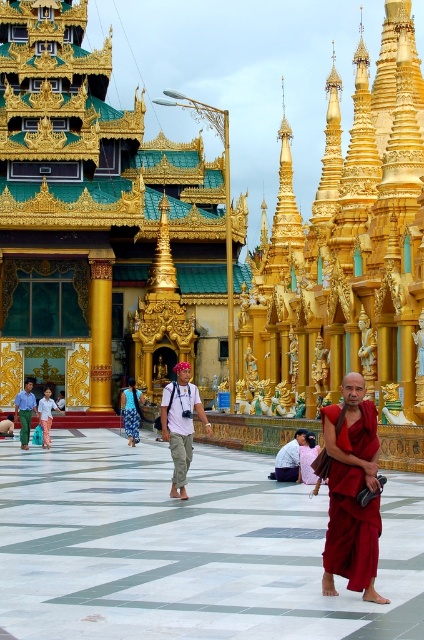
Can you confirm if blue printed fabric robe at center is positioned to the left of light pink cotton pants at center?

Incorrect, blue printed fabric robe at center is not on the left side of light pink cotton pants at center.

In the scene shown: Measure the distance between point (x=133, y=396) and camera.

The distance of point (x=133, y=396) from camera is 99.48 meters.

Who is more forward, (131, 417) or (39, 419)?

Point (39, 419)

The width and height of the screenshot is (424, 640). Identify the location of blue printed fabric robe at center. (131, 412).

Does light brown leather jacket at center have a greater width compared to light pink cotton pants at center?

In fact, light brown leather jacket at center might be narrower than light pink cotton pants at center.

Between light brown leather jacket at center and light pink cotton pants at center, which one has less height?

light brown leather jacket at center

Does point (282, 465) come closer to viewer compared to point (52, 404)?

Yes, point (282, 465) is in front of point (52, 404).

At what (x,y) coordinates should I click in order to perform the action: click on light brown leather jacket at center. Please return your answer as a coordinate pair (x, y). Looking at the image, I should click on (290, 458).

Is point (173, 412) less distant than point (284, 454)?

Yes, point (173, 412) is in front of point (284, 454).

Can you confirm if khaki pants at center is thinner than light brown leather jacket at center?

No.

Where is `khaki pants at center`? The width and height of the screenshot is (424, 640). khaki pants at center is located at coordinates (181, 422).